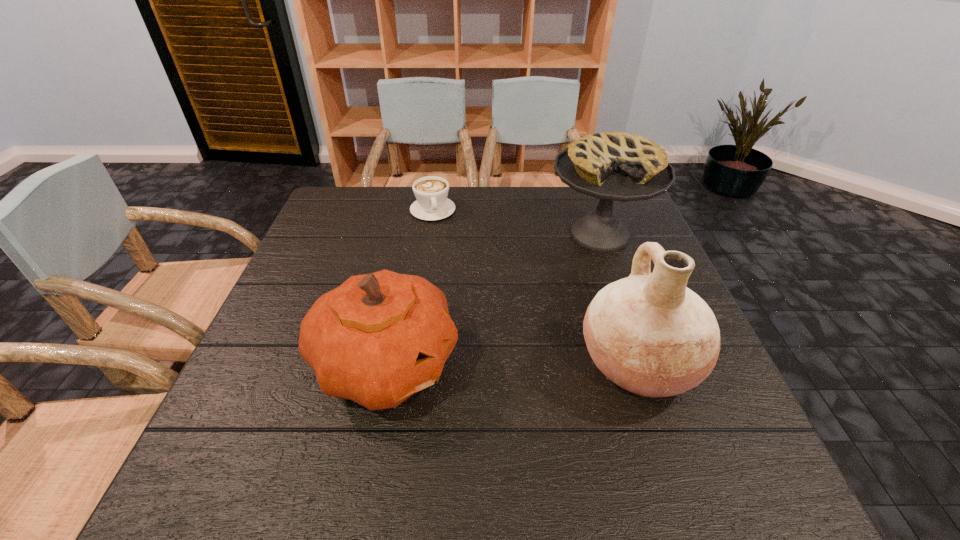
Identify the location of object present at the near right corner. (648, 333).

The width and height of the screenshot is (960, 540). Identify the location of free region at the far edge. (577, 204).

Identify the location of vacant space at the far left corner of the desktop. (358, 199).

This screenshot has height=540, width=960. I want to click on free spot at the near left corner of the desktop, so click(279, 426).

You are a GUI agent. You are given a task and a screenshot of the screen. Output one action in this format:
    pyautogui.click(x=<x>, y=<y>)
    Task: Click on the vacant area at the near right corner
    The image size is (960, 540).
    Given the screenshot: What is the action you would take?
    pyautogui.click(x=669, y=431)

In order to click on free spot between the pottery and the cappuccino in this screenshot , I will do `click(536, 287)`.

I want to click on free spot between the pottery and the shortest object, so click(x=536, y=287).

Image resolution: width=960 pixels, height=540 pixels. In order to click on free space between the pie and the cappuccino in this screenshot , I will do `click(516, 222)`.

This screenshot has width=960, height=540. Find the location of `free space between the pie and the pumpkin`. free space between the pie and the pumpkin is located at coordinates pos(492,299).

Locate an element on the screen. The width and height of the screenshot is (960, 540). empty space between the pumpkin and the pottery is located at coordinates (512, 364).